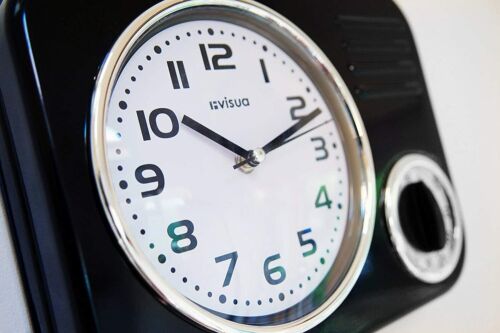
Find the location of `wall`. wall is located at coordinates (489, 91).